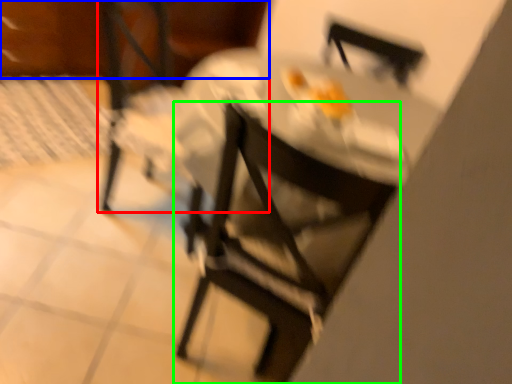
Question: Which object is positioned closest to chair (highlighted by a red box)? Select from leftover (highlighted by a blue box) and chair (highlighted by a green box).

Choices:
 (A) leftover
 (B) chair

Answer: (A)